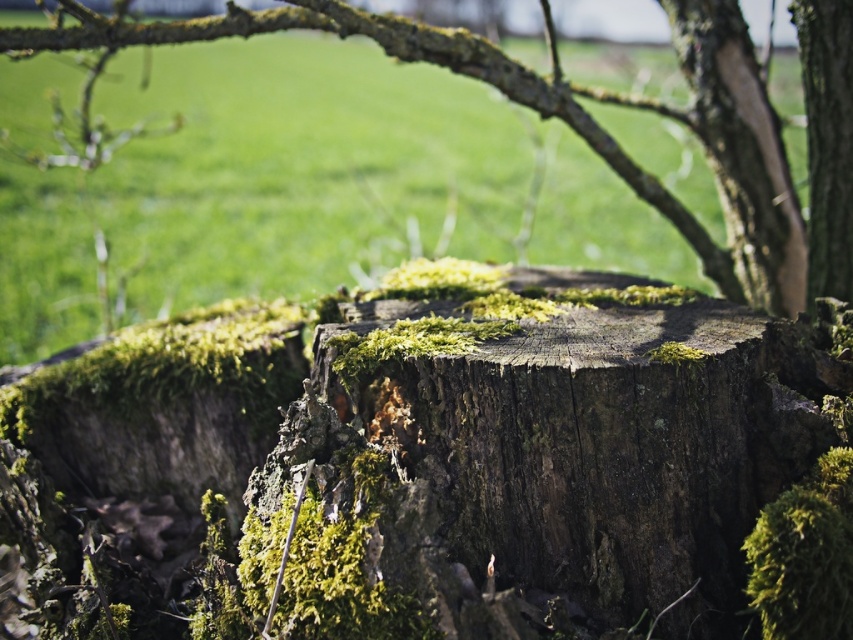
Question: Does green mossy wood at center have a lesser width compared to smooth bark tree trunk at right?

Choices:
 (A) no
 (B) yes

Answer: (A)

Question: Which point is farther to the camera?

Choices:
 (A) smooth bark tree trunk at right
 (B) smooth bark tree trunk at upper right

Answer: (B)

Question: Among these objects, which one is nearest to the camera?

Choices:
 (A) smooth bark tree trunk at upper right
 (B) green mossy wood at center
 (C) smooth bark tree trunk at right

Answer: (B)

Question: Can you confirm if green mossy wood at center is positioned above smooth bark tree trunk at right?

Choices:
 (A) no
 (B) yes

Answer: (B)

Question: Among these objects, which one is farthest from the camera?

Choices:
 (A) smooth bark tree trunk at right
 (B) green mossy wood at center
 (C) smooth bark tree trunk at upper right

Answer: (C)

Question: Is green mossy wood at center to the right of smooth bark tree trunk at upper right from the viewer's perspective?

Choices:
 (A) yes
 (B) no

Answer: (B)